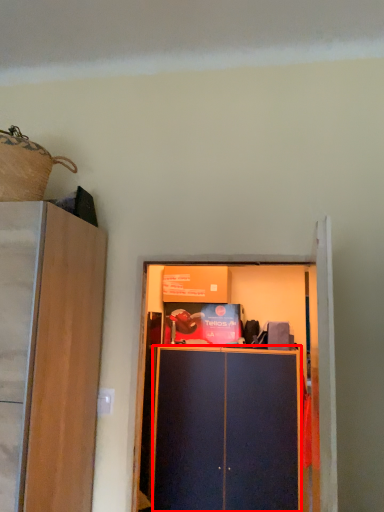
Question: From the image's perspective, where is cabinetry (annotated by the red box) located in relation to cupboard in the image?

Choices:
 (A) above
 (B) below

Answer: (B)